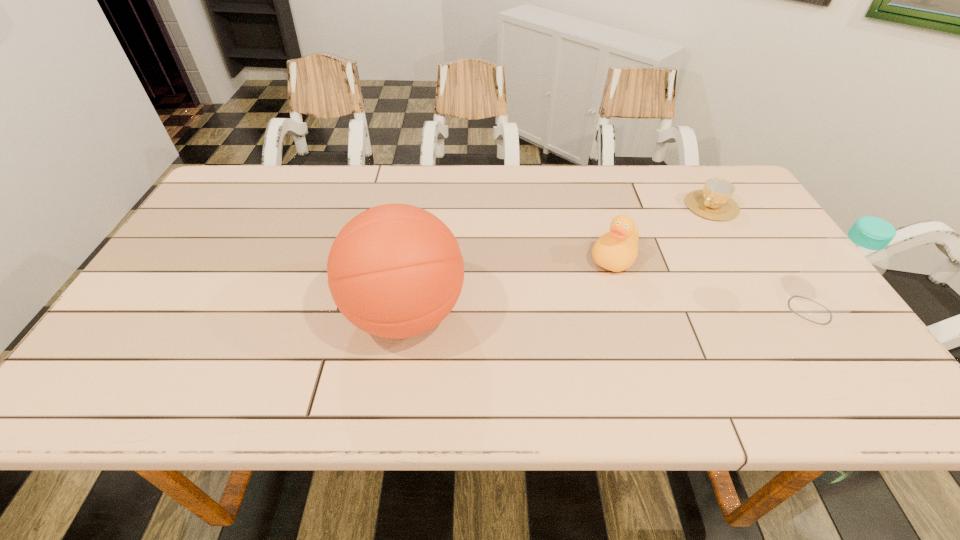
Where is `the leftmost object`? the leftmost object is located at coordinates (395, 271).

The image size is (960, 540). What are the coordinates of `bottle` in the screenshot? It's located at (828, 288).

Identify the location of the shortest object. The height and width of the screenshot is (540, 960). (714, 201).

This screenshot has height=540, width=960. Find the location of `cup`. cup is located at coordinates (714, 201).

Locate an element on the screen. Image resolution: width=960 pixels, height=540 pixels. the third tallest object is located at coordinates [x=616, y=250].

Identify the location of the second object from left to right. Image resolution: width=960 pixels, height=540 pixels. (616, 250).

Identify the location of vacant space located 0.200m on the left of the leftmost object. The width and height of the screenshot is (960, 540). (259, 314).

In order to click on vacant space located on the back of the bottle in this screenshot , I will do 746,215.

In order to click on vacant position located with the handle on the side of the shortest object in this screenshot , I will do `click(667, 244)`.

This screenshot has height=540, width=960. I want to click on free space located 0.260m with the handle on the side of the shortest object, so click(x=649, y=259).